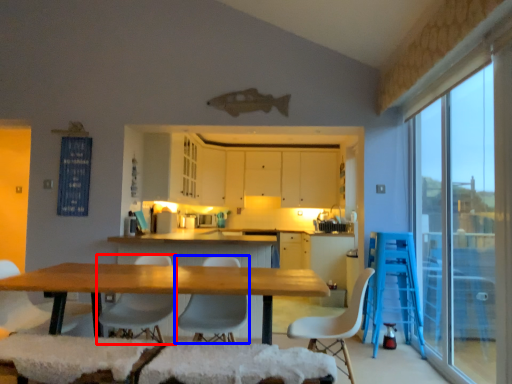
Question: Which point is further to the camera, chair (highlighted by a red box) or chair (highlighted by a blue box)?

Choices:
 (A) chair
 (B) chair

Answer: (A)